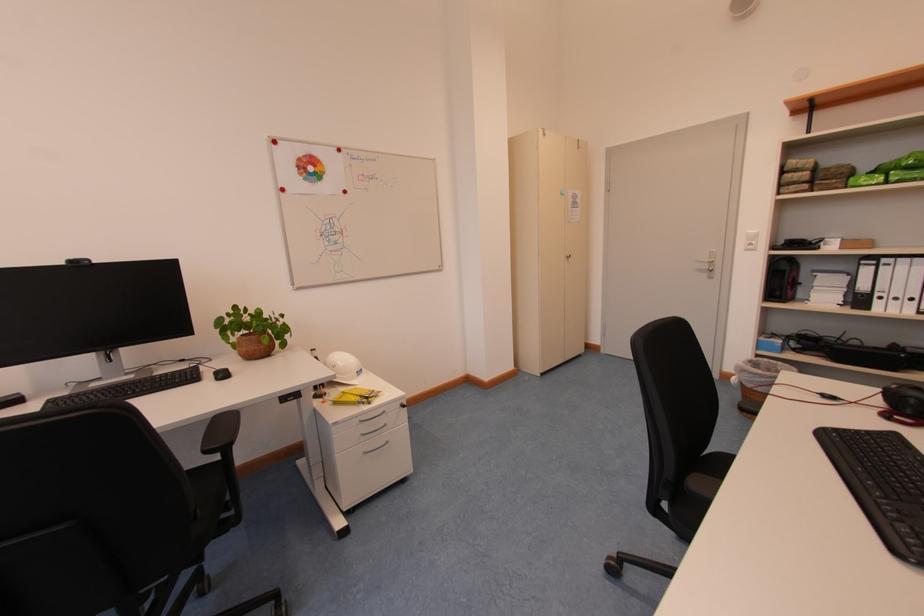
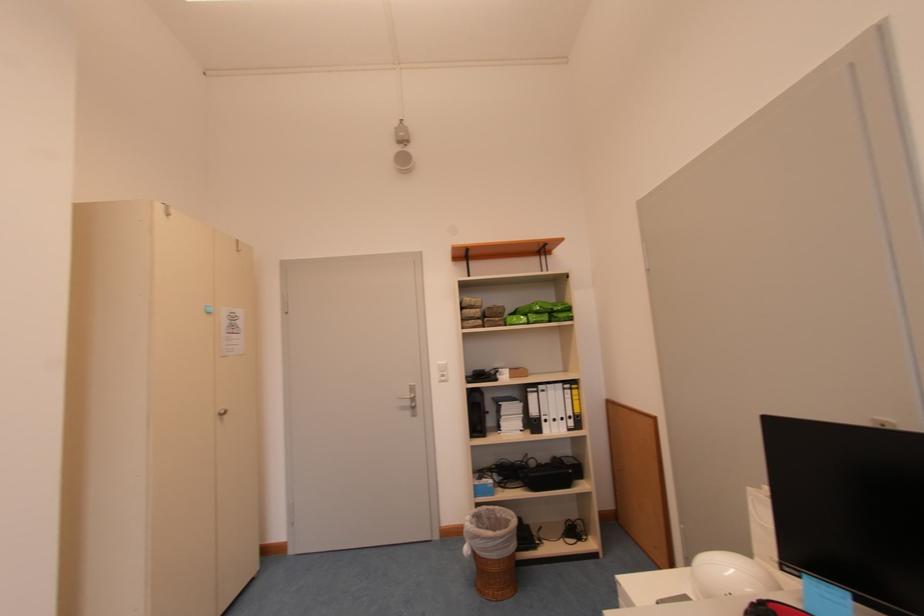
Locate, in the second image, the point that corresponds to (x=870, y=290) in the first image.

(541, 415)